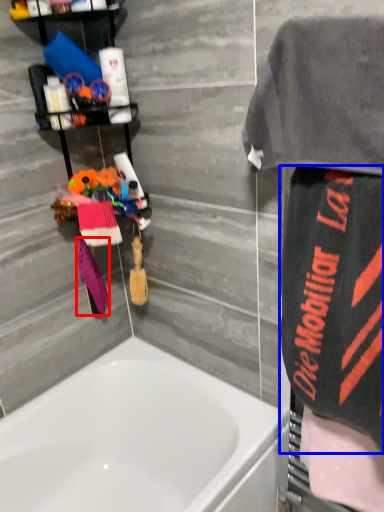
Question: Which of the following is the closest to the observer, beach towel (highlighted by a red box) or beach towel (highlighted by a blue box)?

Choices:
 (A) beach towel
 (B) beach towel

Answer: (B)